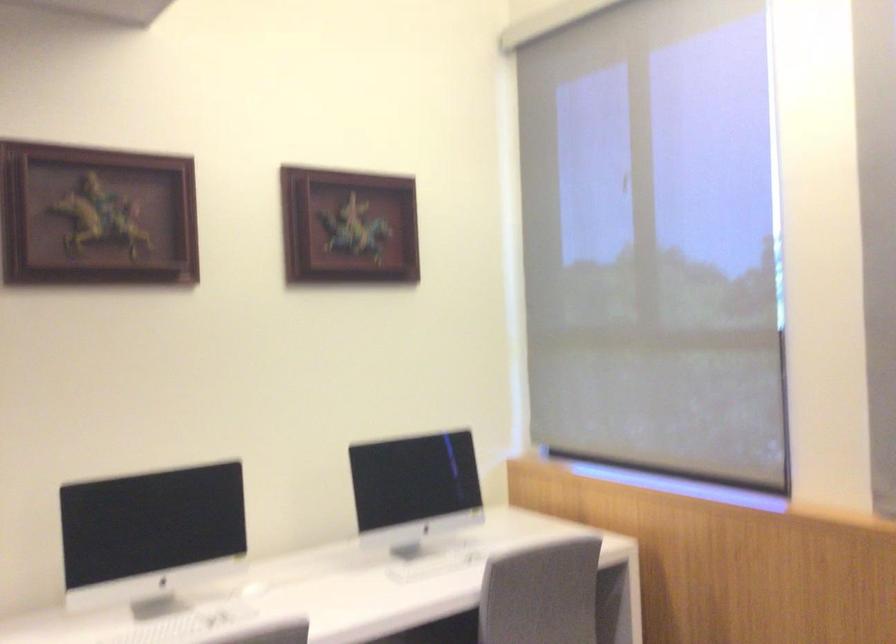
The image size is (896, 644). Find the location of `roller blind bar`. roller blind bar is located at coordinates (514, 35).